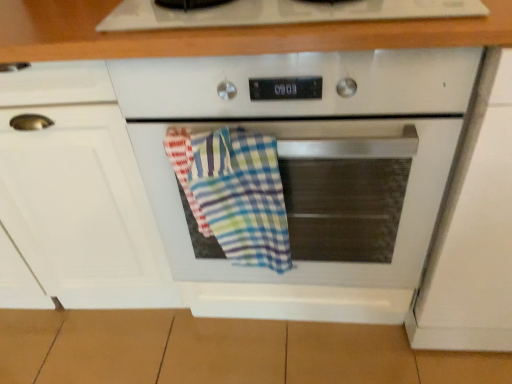
Question: Is multicolored checkered towel at center inside white matte cabinet at right, the 1th cabinetry from the right?

Choices:
 (A) yes
 (B) no

Answer: (B)

Question: Considering the relative sizes of white matte cabinet at right, the 1th cabinetry from the right, and multicolored checkered towel at center in the image provided, is white matte cabinet at right, the 1th cabinetry from the right, thinner than multicolored checkered towel at center?

Choices:
 (A) no
 (B) yes

Answer: (A)

Question: Is white matte cabinet at right, which is counted as the 2th cabinetry, starting from the left, oriented towards multicolored checkered towel at center?

Choices:
 (A) yes
 (B) no

Answer: (B)

Question: Can you confirm if white matte cabinet at right, which is counted as the 2th cabinetry, starting from the left, is positioned to the right of multicolored checkered towel at center?

Choices:
 (A) yes
 (B) no

Answer: (A)

Question: From the image's perspective, is white matte cabinet at right, the 1th cabinetry from the right, over multicolored checkered towel at center?

Choices:
 (A) no
 (B) yes

Answer: (B)

Question: Can you confirm if white matte cabinet at right, the 1th cabinetry from the right, is wider than multicolored checkered towel at center?

Choices:
 (A) no
 (B) yes

Answer: (B)

Question: From a real-world perspective, does white matte cabinet at left, which is counted as the second cabinetry, starting from the right, sit lower than multicolored checkered towel at center?

Choices:
 (A) no
 (B) yes

Answer: (B)

Question: From the image's perspective, is white matte cabinet at left, which is counted as the second cabinetry, starting from the right, on top of multicolored checkered towel at center?

Choices:
 (A) no
 (B) yes

Answer: (B)

Question: Does white matte cabinet at left, which is counted as the second cabinetry, starting from the right, have a greater width compared to multicolored checkered towel at center?

Choices:
 (A) no
 (B) yes

Answer: (B)

Question: Is white matte cabinet at left, marked as the 1th cabinetry in a left-to-right arrangement, not inside multicolored checkered towel at center?

Choices:
 (A) yes
 (B) no

Answer: (A)

Question: Considering the relative sizes of white matte cabinet at left, which is counted as the second cabinetry, starting from the right, and multicolored checkered towel at center in the image provided, is white matte cabinet at left, which is counted as the second cabinetry, starting from the right, taller than multicolored checkered towel at center?

Choices:
 (A) no
 (B) yes

Answer: (B)

Question: Is white matte cabinet at left, which is counted as the second cabinetry, starting from the right, further to the viewer compared to multicolored checkered towel at center?

Choices:
 (A) yes
 (B) no

Answer: (B)

Question: Can you confirm if multicolored checkered towel at center is positioned to the right of white matte cabinet at left, marked as the 1th cabinetry in a left-to-right arrangement?

Choices:
 (A) no
 (B) yes

Answer: (B)